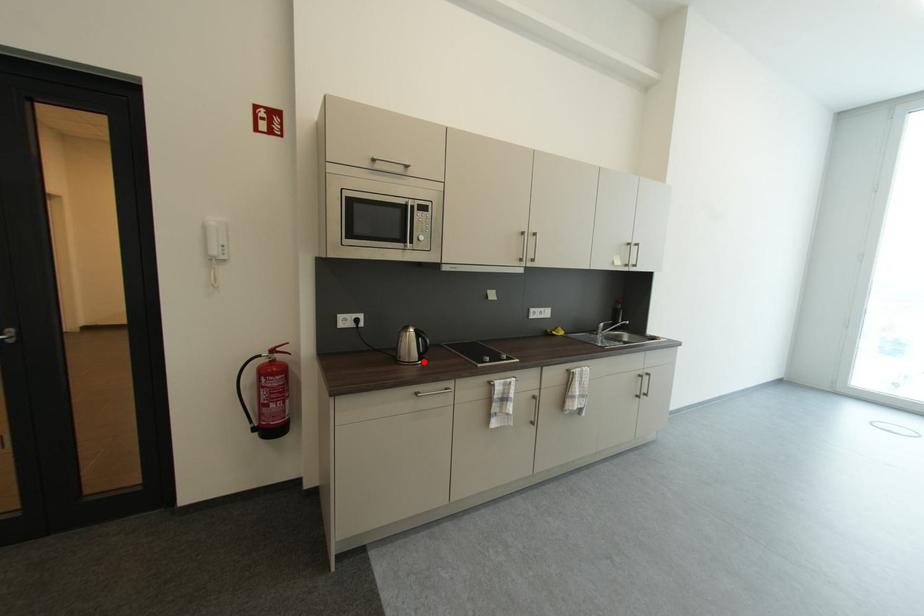
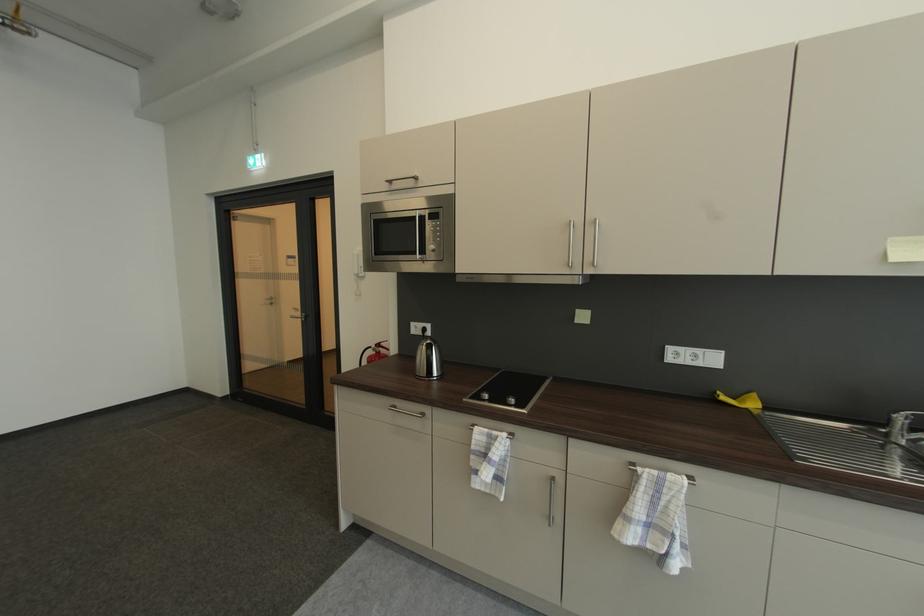
Locate, in the second image, the point that corresponds to the highlighted location in the first image.

(432, 378)